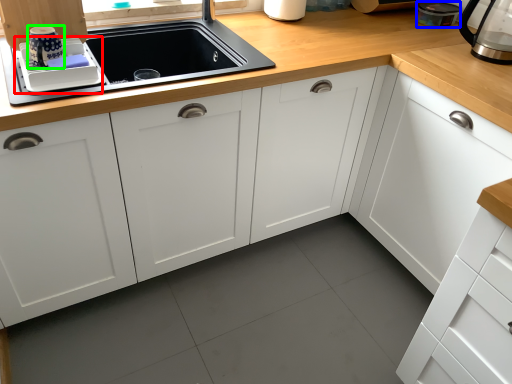
Question: Which object is the closest to the appliance (highlighted by a red box)? Choose among these: appliance (highlighted by a blue box) or appliance (highlighted by a green box).

Choices:
 (A) appliance
 (B) appliance

Answer: (B)